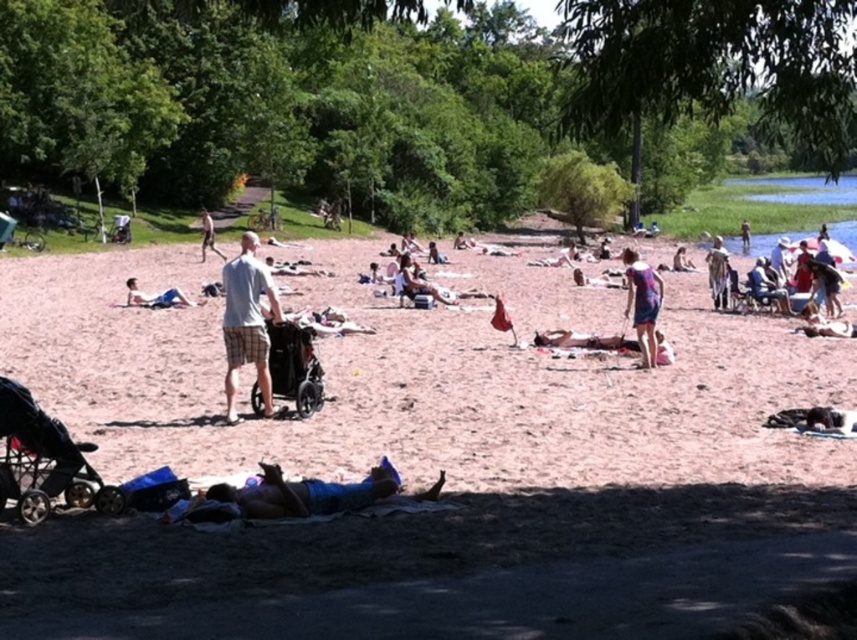
Question: Which point is closer to the camera?

Choices:
 (A) (237, 500)
 (B) (850, 200)

Answer: (A)

Question: Which point appears closest to the camera in this image?

Choices:
 (A) (334, 483)
 (B) (428, 323)
 (C) (774, 237)
 (D) (680, 262)

Answer: (A)

Question: Is gray plaid shorts at center further to camera compared to light brown fur at center?

Choices:
 (A) yes
 (B) no

Answer: (B)

Question: Based on their relative distances, which object is nearer to the light blue denim shorts at center?

Choices:
 (A) blue fabric at lower center
 (B) light brown fur at center
 (C) pink sand at center
 (D) brown leather bag at center

Answer: (B)

Question: Where is dark gray plastic stroller at center located in relation to light blue denim shorts at center in the image?

Choices:
 (A) below
 (B) above

Answer: (A)

Question: Is brown leather bag at center thinner than light blue denim shorts at center?

Choices:
 (A) no
 (B) yes

Answer: (B)